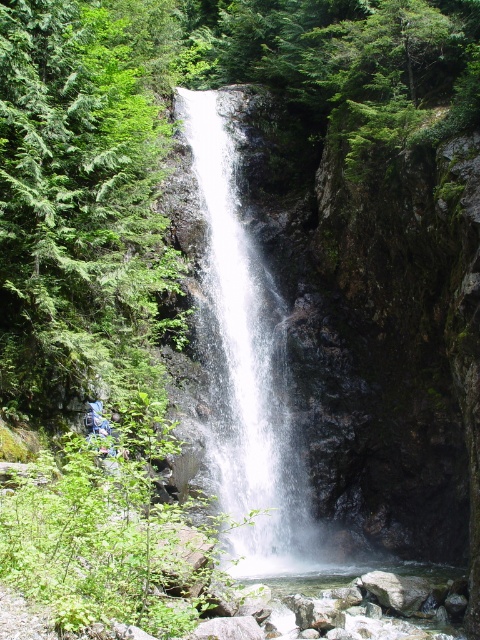
Question: Which of the following is the farthest from the observer?

Choices:
 (A) (36, 177)
 (B) (233, 250)

Answer: (B)

Question: Does green textured tree at upper left appear under white frothy water at center?

Choices:
 (A) yes
 (B) no

Answer: (B)

Question: Is green textured tree at upper left below white frothy water at center?

Choices:
 (A) no
 (B) yes

Answer: (A)

Question: Is green textured tree at upper left thinner than white frothy water at center?

Choices:
 (A) no
 (B) yes

Answer: (B)

Question: Which point is closer to the camera?

Choices:
 (A) (48, 145)
 (B) (203, 172)

Answer: (A)